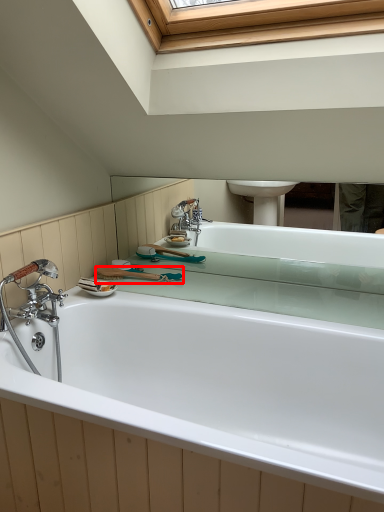
Question: From the image's perspective, what is the correct spatial relationship of shower (annotated by the red box) in relation to bathtub?

Choices:
 (A) below
 (B) above

Answer: (B)